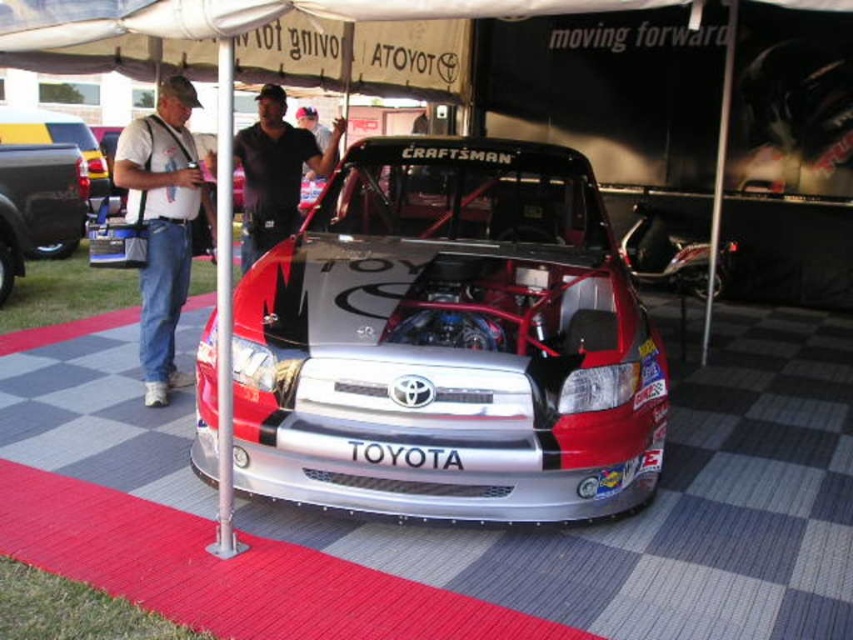
Can you confirm if white cotton t-shirt at left is wider than matte black truck at left?

No.

Who is more distant from viewer, [183,141] or [28,157]?

The point [28,157] is behind.

Between point (125, 212) and point (28, 212), which one is positioned in front?

Point (28, 212) is in front.

In order to click on white cotton t-shirt at left in this screenshot , I will do `click(163, 224)`.

Does point (392, 352) come in front of point (187, 234)?

Yes.

Can you confirm if shiny metallic race car at center is smaller than white cotton t-shirt at left?

Incorrect, shiny metallic race car at center is not smaller in size than white cotton t-shirt at left.

Locate an element on the screen. The image size is (853, 640). shiny metallic race car at center is located at coordinates (450, 342).

At what (x,y) coordinates should I click in order to perform the action: click on shiny metallic race car at center. Please return your answer as a coordinate pair (x, y). The height and width of the screenshot is (640, 853). Looking at the image, I should click on (450, 342).

Is point (373, 360) closer to viewer compared to point (45, 221)?

Yes.

Which is behind, point (550, 323) or point (38, 180)?

The point (38, 180) is more distant.

Does point (587, 348) come in front of point (20, 205)?

Yes, it is.

Locate an element on the screen. The width and height of the screenshot is (853, 640). shiny metallic race car at center is located at coordinates (450, 342).